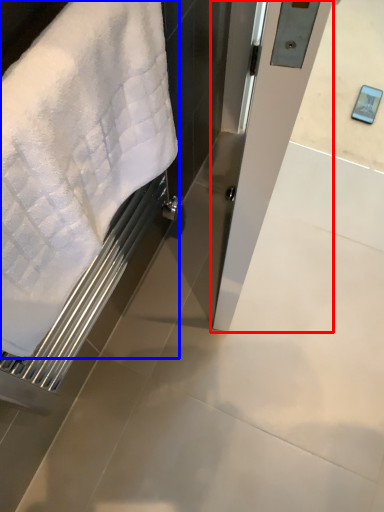
Question: Which point is further to the camera, screen door (highlighted by a red box) or towel (highlighted by a blue box)?

Choices:
 (A) screen door
 (B) towel

Answer: (A)